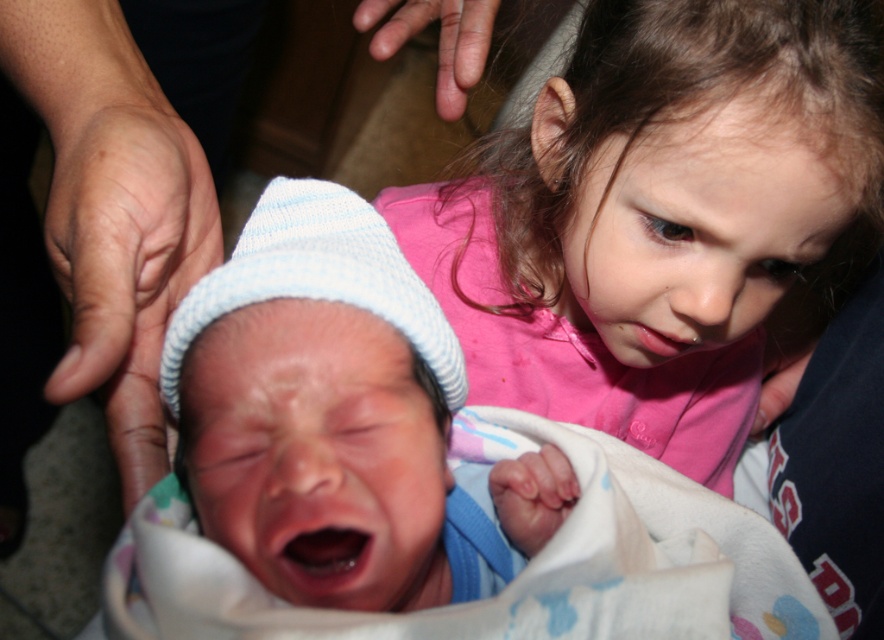
Question: Is blue knit hat at center above pink cotton shirt at upper right?

Choices:
 (A) no
 (B) yes

Answer: (A)

Question: Is blue knit hat at center to the right of pink cotton shirt at upper right from the viewer's perspective?

Choices:
 (A) no
 (B) yes

Answer: (A)

Question: Considering the relative positions of blue knit hat at center and pink cotton shirt at upper right in the image provided, where is blue knit hat at center located with respect to pink cotton shirt at upper right?

Choices:
 (A) right
 (B) left

Answer: (B)